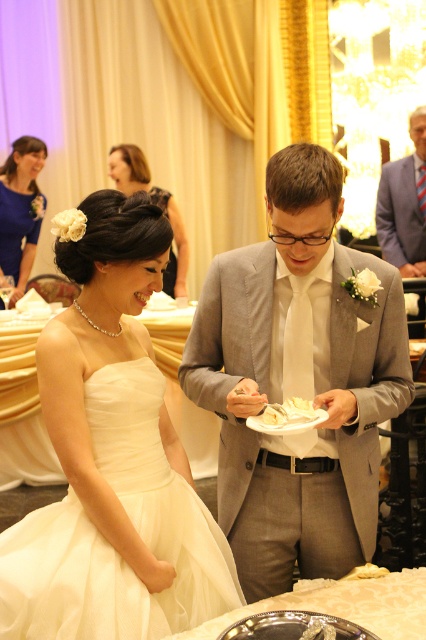
Looking at this image, you are a photographer at the wedding reception. You need to capture a photo of both the light blue textured suit at upper right and the blue satin dress at upper left. Which one will appear closer to the camera in the photo?

The light blue textured suit at upper right will appear closer to the camera because it is further to the viewer than the blue satin dress at upper left.

You are a photographer at the wedding reception and need to decide which dress to focus on for a closeup shot. Since the white satin dress at left is larger in size than the satin black dress at upper left, which dress should you choose to ensure the entire dress fits in the frame?

The white satin dress at left is larger in size than the satin black dress at upper left, so you should choose the white satin dress at left to ensure the entire dress fits in the frame.

You are standing at the entrance of the grand hall and see two points marked in the image. The first point is at coordinate point(0, 579) and the second is at point(120, 176). Which point is closer to you?

Point(0, 579) is in front of point(120, 176), so it is closer to you.